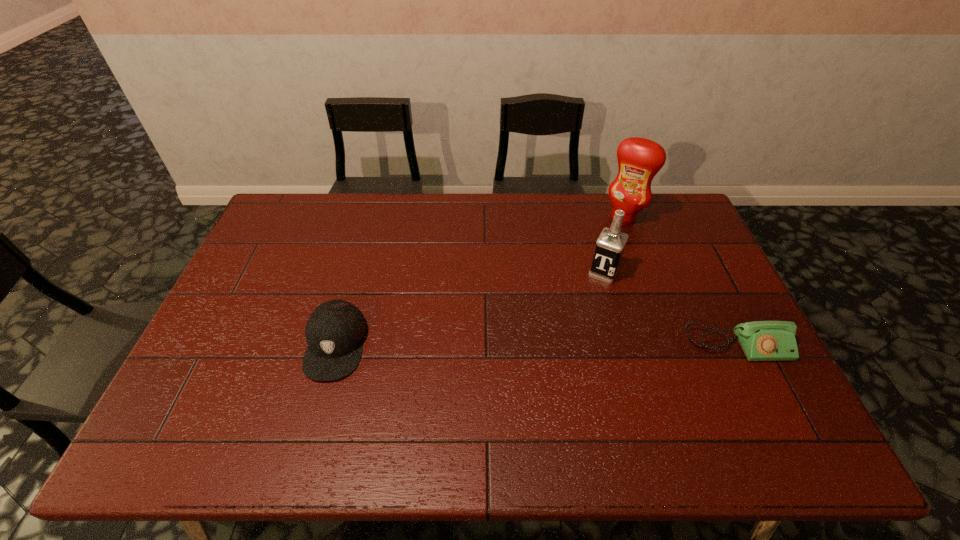
This screenshot has width=960, height=540. In the image, there is a desktop. Identify the location of vacant space at the right edge. (733, 338).

This screenshot has width=960, height=540. Identify the location of free point at the far left corner. (272, 230).

The height and width of the screenshot is (540, 960). What are the coordinates of `vacant region at the near left corner of the desktop` in the screenshot? It's located at (217, 405).

In the image, there is a desktop. Where is `vacant space at the far right corner`? vacant space at the far right corner is located at coordinates (655, 204).

At what (x,y) coordinates should I click in order to perform the action: click on free spot between the second shortest object and the vodka. Please return your answer as a coordinate pair (x, y). The height and width of the screenshot is (540, 960). Looking at the image, I should click on (469, 309).

Where is `vacant point located between the leftmost object and the shortest object`? The image size is (960, 540). vacant point located between the leftmost object and the shortest object is located at coordinates (536, 345).

At what (x,y) coordinates should I click in order to perform the action: click on free space between the second shortest object and the third nearest object. Please return your answer as a coordinate pair (x, y). Looking at the image, I should click on (469, 309).

Identify the location of vacant area that lies between the third object from right to left and the telephone. Image resolution: width=960 pixels, height=540 pixels. (670, 309).

The image size is (960, 540). I want to click on vacant space that is in between the shortest object and the second shortest object, so click(536, 345).

This screenshot has width=960, height=540. I want to click on vacant area that lies between the telephone and the third tallest object, so click(x=536, y=345).